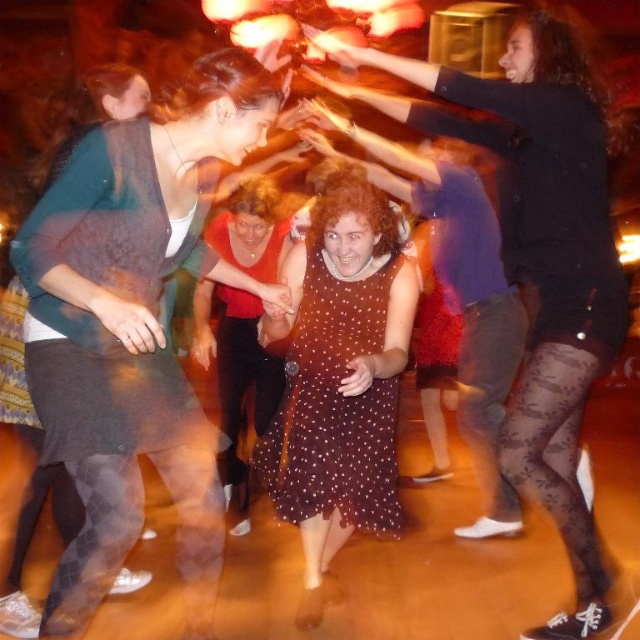
Question: Can you confirm if matte black skirt at left is positioned to the right of dark brown textured dress at left?

Choices:
 (A) no
 (B) yes

Answer: (B)

Question: Does dark brown textured dress at left appear over brown dotted dress at center?

Choices:
 (A) no
 (B) yes

Answer: (B)

Question: Which of the following is the closest to the observer?

Choices:
 (A) brown dotted dress at center
 (B) dark brown textured dress at left

Answer: (B)

Question: Among these points, which one is farthest from the camera?

Choices:
 (A) (49, 240)
 (B) (64, 216)
 (C) (269, 428)

Answer: (C)

Question: Is dark brown textured dress at left behind brown dotted dress at center?

Choices:
 (A) no
 (B) yes

Answer: (A)

Question: Which point is closer to the camera?

Choices:
 (A) brown dotted dress at center
 (B) matte black skirt at left

Answer: (B)